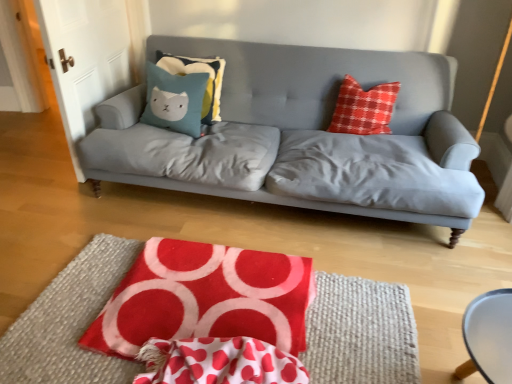
Question: From a real-world perspective, is red velvety quilt at lower center on teal fabric pillow with cat design at center, placed as the second pillow when sorted from front to back?

Choices:
 (A) yes
 (B) no

Answer: (B)

Question: Can you confirm if red velvety quilt at lower center is positioned to the right of teal fabric pillow with cat design at center, placed as the second pillow when sorted from front to back?

Choices:
 (A) no
 (B) yes

Answer: (B)

Question: Can you confirm if red velvety quilt at lower center is shorter than teal fabric pillow with cat design at center, which appears as the 1th pillow when viewed from the back?

Choices:
 (A) no
 (B) yes

Answer: (B)

Question: Is there a large distance between red velvety quilt at lower center and teal fabric pillow with cat design at center, placed as the second pillow when sorted from front to back?

Choices:
 (A) yes
 (B) no

Answer: (A)

Question: Does red velvety quilt at lower center have a smaller size compared to teal fabric pillow with cat design at center, placed as the second pillow when sorted from front to back?

Choices:
 (A) yes
 (B) no

Answer: (B)

Question: Is red velvety quilt at lower center further to camera compared to teal fabric pillow with cat design at center, placed as the second pillow when sorted from front to back?

Choices:
 (A) no
 (B) yes

Answer: (A)

Question: From the image's perspective, is matte gray couch at center located beneath red felt rug at center?

Choices:
 (A) yes
 (B) no

Answer: (B)

Question: Is matte gray couch at center positioned far away from red felt rug at center?

Choices:
 (A) no
 (B) yes

Answer: (B)

Question: Is red felt rug at center a part of matte gray couch at center?

Choices:
 (A) yes
 (B) no

Answer: (B)

Question: Does matte gray couch at center have a larger size compared to red felt rug at center?

Choices:
 (A) no
 (B) yes

Answer: (B)

Question: Is matte gray couch at center shorter than red felt rug at center?

Choices:
 (A) yes
 (B) no

Answer: (B)

Question: Can you confirm if matte gray couch at center is taller than red felt rug at center?

Choices:
 (A) yes
 (B) no

Answer: (A)

Question: Is the depth of red felt rug at center less than that of smooth white table at lower right?

Choices:
 (A) yes
 (B) no

Answer: (B)